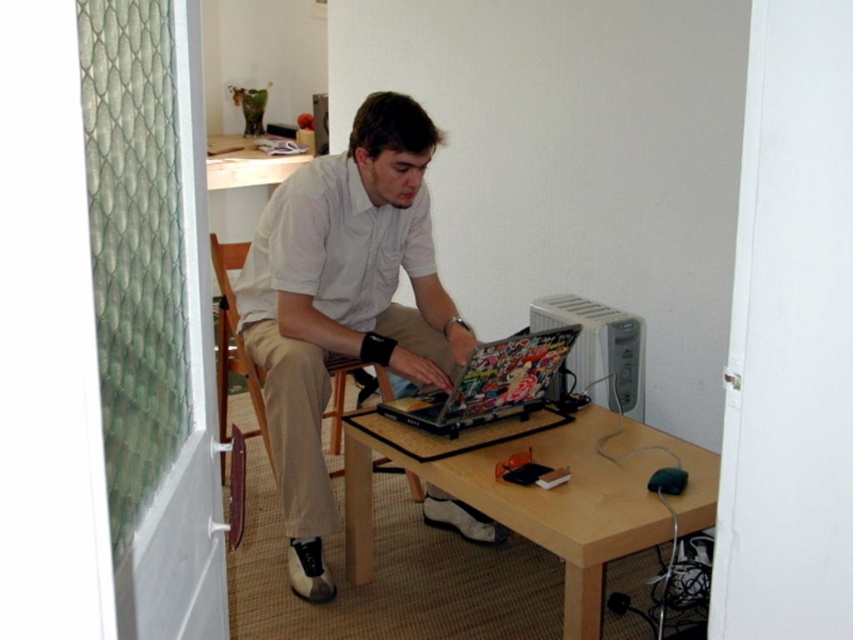
Question: Is light brown wood table at center wider than shiny plastic laptop at center?

Choices:
 (A) no
 (B) yes

Answer: (B)

Question: Estimate the real-world distances between objects in this image. Which object is closer to the shiny plastic laptop at center?

Choices:
 (A) light brown wood table at center
 (B) wooden chair at center

Answer: (A)

Question: Is light brown wood table at center in front of shiny plastic laptop at center?

Choices:
 (A) no
 (B) yes

Answer: (B)

Question: Is light beige cotton shirt at center to the left of wooden chair at center from the viewer's perspective?

Choices:
 (A) yes
 (B) no

Answer: (B)

Question: Which point is farther from the camera taking this photo?

Choices:
 (A) (494, 372)
 (B) (351, 481)
 (C) (219, 298)

Answer: (C)

Question: Among these objects, which one is nearest to the camera?

Choices:
 (A) shiny plastic laptop at center
 (B) light beige cotton shirt at center
 (C) wooden chair at center
 (D) light brown wood table at center

Answer: (D)